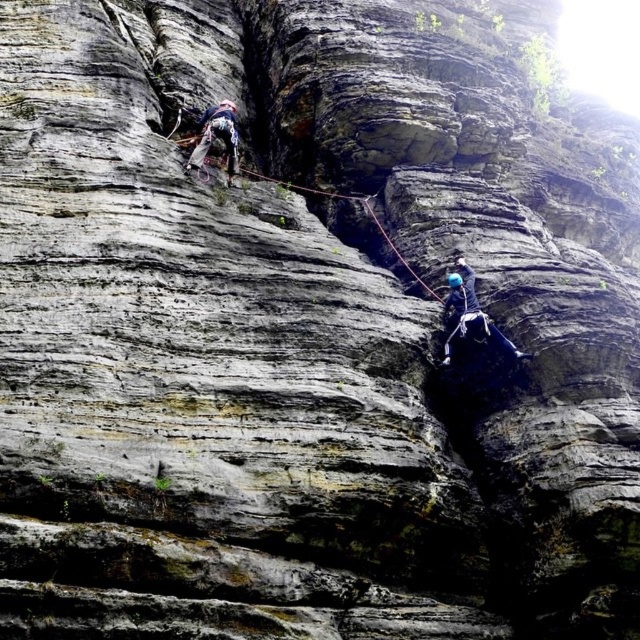
Question: Can you confirm if blue fabric climbing harness at upper left is bigger than red nylon rope at center?

Choices:
 (A) yes
 (B) no

Answer: (B)

Question: Can you confirm if blue fabric climbing harness at upper left is positioned to the right of red nylon rope at center?

Choices:
 (A) yes
 (B) no

Answer: (B)

Question: Among these points, which one is farthest from the camera?

Choices:
 (A) (369, 211)
 (B) (234, 147)

Answer: (A)

Question: Is blue fabric climbing harness at upper left smaller than red nylon rope at center?

Choices:
 (A) no
 (B) yes

Answer: (B)

Question: Among these objects, which one is nearest to the camera?

Choices:
 (A) blue fabric climbing harness at upper left
 (B) red nylon rope at center

Answer: (A)